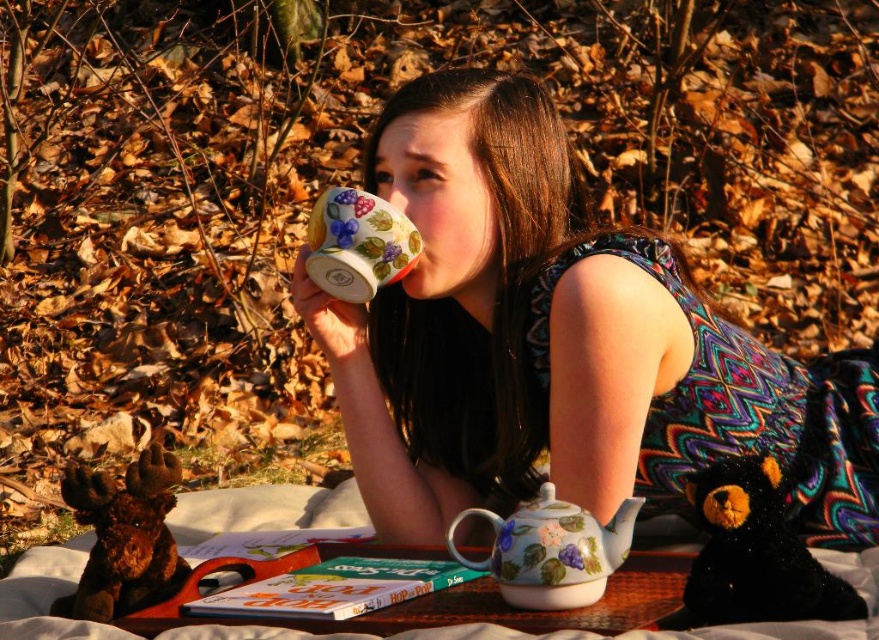
Question: Which of the following is the closest to the observer?

Choices:
 (A) floral porcelain teapot at lower center
 (B) black plush bear at lower right
 (C) porcelain floral cup at upper center
 (D) floral ceramic mug at upper center

Answer: (B)

Question: Which of the following is the closest to the observer?

Choices:
 (A) (372, 198)
 (B) (563, 600)
 (C) (756, 608)

Answer: (C)

Question: Is floral ceramic mug at upper center below black plush bear at lower right?

Choices:
 (A) no
 (B) yes

Answer: (A)

Question: Is the position of black plush bear at lower right less distant than that of porcelain floral cup at upper center?

Choices:
 (A) no
 (B) yes

Answer: (B)

Question: Which object is positioned closest to the floral ceramic mug at upper center?

Choices:
 (A) floral porcelain teapot at lower center
 (B) porcelain floral cup at upper center
 (C) black plush bear at lower right

Answer: (B)

Question: Is floral ceramic mug at upper center to the right of porcelain floral cup at upper center from the viewer's perspective?

Choices:
 (A) no
 (B) yes

Answer: (B)